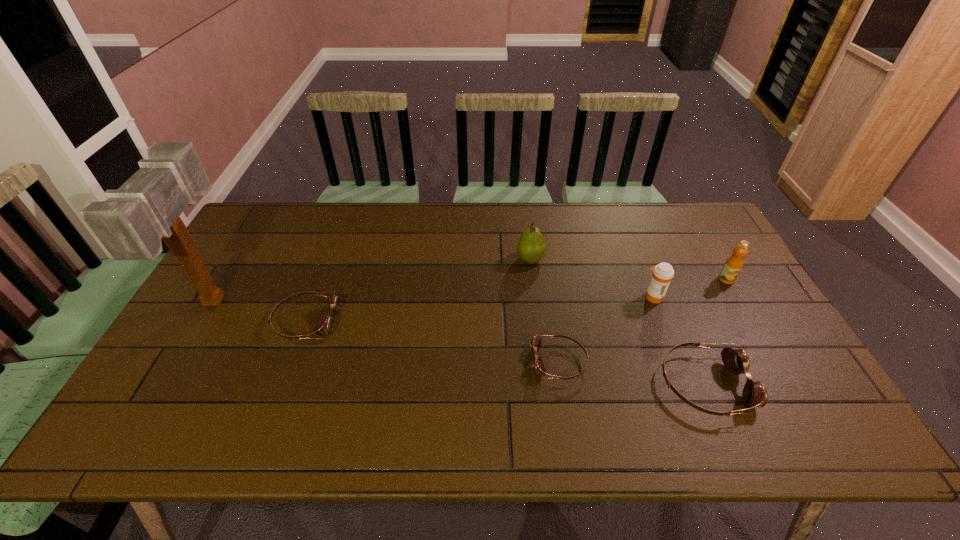
Locate an element on the screen. The width and height of the screenshot is (960, 540). orange juice is located at coordinates (733, 265).

Identify the location of vacant point located through the lenses of the sixth tallest object. (389, 321).

Where is `free space located through the lenses of the shortest goggles`? The width and height of the screenshot is (960, 540). free space located through the lenses of the shortest goggles is located at coordinates (477, 362).

Image resolution: width=960 pixels, height=540 pixels. What are the coordinates of `free space located 0.340m through the lenses of the shortest goggles` in the screenshot? It's located at (398, 362).

The image size is (960, 540). I want to click on free space located through the lenses of the shortest goggles, so click(x=445, y=362).

Where is `free space located 0.140m through the lenses of the rightmost goggles`? free space located 0.140m through the lenses of the rightmost goggles is located at coordinates (804, 384).

Where is `vacant space situated on the front of the medicine`? This screenshot has height=540, width=960. vacant space situated on the front of the medicine is located at coordinates (689, 390).

At what (x,y) coordinates should I click in order to perform the action: click on vacant area located on the right of the leftmost object. Please return your answer as a coordinate pair (x, y). This screenshot has height=540, width=960. Looking at the image, I should click on (349, 300).

You are a GUI agent. You are given a task and a screenshot of the screen. Output one action in this format:
    pyautogui.click(x=<x>, y=<y>)
    Task: Click on the vacant space located 0.180m on the left of the pear
    This screenshot has width=960, height=540.
    Given the screenshot: What is the action you would take?
    pyautogui.click(x=460, y=259)

At what (x,y) coordinates should I click in order to perform the action: click on vacant area situated 0.380m on the front label of the orange juice. Please return your answer as a coordinate pair (x, y). The image size is (960, 540). Looking at the image, I should click on (794, 397).